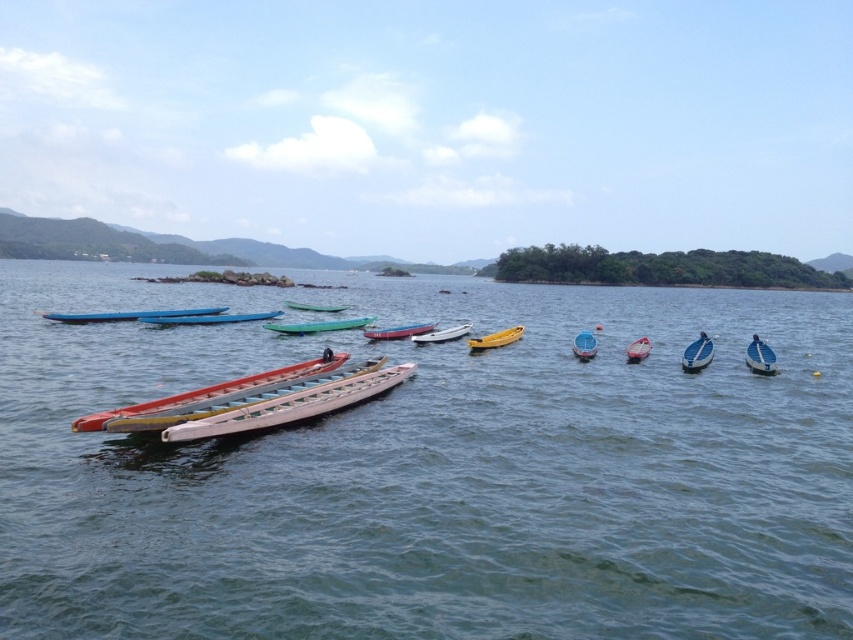
In the scene shown: You are standing on the lakeside dock and see the white glossy canoe at center and the green plastic boat at center. Which boat is closer to the water surface?

The white glossy canoe at center is positioned under the green plastic boat at center, so it is closer to the water surface.

You are standing on the lakeside dock and see two canoes floating on the lake. The white plastic canoe at center and the metallic silver canoe at center. Which canoe is closer to the water surface?

The metallic silver canoe at center is closer to the water surface because the white plastic canoe at center is located above it.